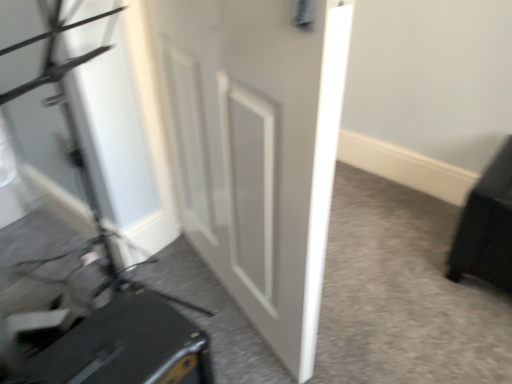
Question: Considering the relative positions of black matte suitcase at lower left and matte black suitcase at lower left in the image provided, is black matte suitcase at lower left behind matte black suitcase at lower left?

Choices:
 (A) yes
 (B) no

Answer: (B)

Question: Does black matte suitcase at lower left have a smaller size compared to matte black suitcase at lower left?

Choices:
 (A) yes
 (B) no

Answer: (B)

Question: Is black matte suitcase at lower left in front of matte black suitcase at lower left?

Choices:
 (A) no
 (B) yes

Answer: (B)

Question: Is black matte suitcase at lower left in contact with matte black suitcase at lower left?

Choices:
 (A) no
 (B) yes

Answer: (A)

Question: Considering the relative sizes of black matte suitcase at lower left and matte black suitcase at lower left in the image provided, is black matte suitcase at lower left shorter than matte black suitcase at lower left?

Choices:
 (A) yes
 (B) no

Answer: (B)

Question: Does black matte suitcase at lower left have a lesser width compared to matte black suitcase at lower left?

Choices:
 (A) yes
 (B) no

Answer: (B)

Question: Would you say black matte suitcase at lower left is part of matte black suitcase at lower left's contents?

Choices:
 (A) no
 (B) yes

Answer: (A)

Question: Can you confirm if matte black suitcase at lower left is taller than black matte suitcase at lower left?

Choices:
 (A) no
 (B) yes

Answer: (A)

Question: Is matte black suitcase at lower left further to camera compared to black matte suitcase at lower left?

Choices:
 (A) no
 (B) yes

Answer: (B)

Question: Is matte black suitcase at lower left at the left side of black matte suitcase at lower left?

Choices:
 (A) yes
 (B) no

Answer: (B)

Question: Is matte black suitcase at lower left not close to black matte suitcase at lower left?

Choices:
 (A) no
 (B) yes

Answer: (A)

Question: Considering the relative sizes of matte black suitcase at lower left and black matte suitcase at lower left in the image provided, is matte black suitcase at lower left thinner than black matte suitcase at lower left?

Choices:
 (A) yes
 (B) no

Answer: (A)

Question: From the image's perspective, is white matte door at center above matte black suitcase at lower left?

Choices:
 (A) yes
 (B) no

Answer: (A)